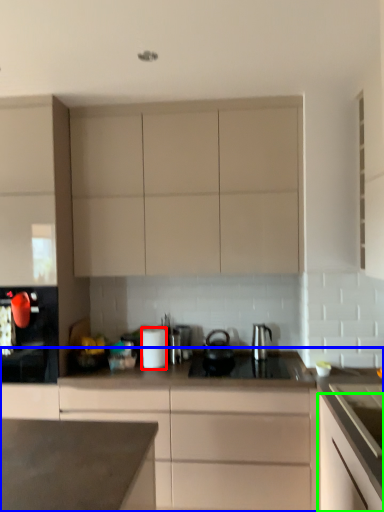
Question: Estimate the real-world distances between objects in this image. Which object is closer to kitchen appliance (highlighted by a red box), cabinetry (highlighted by a blue box) or cabinetry (highlighted by a green box)?

Choices:
 (A) cabinetry
 (B) cabinetry

Answer: (A)